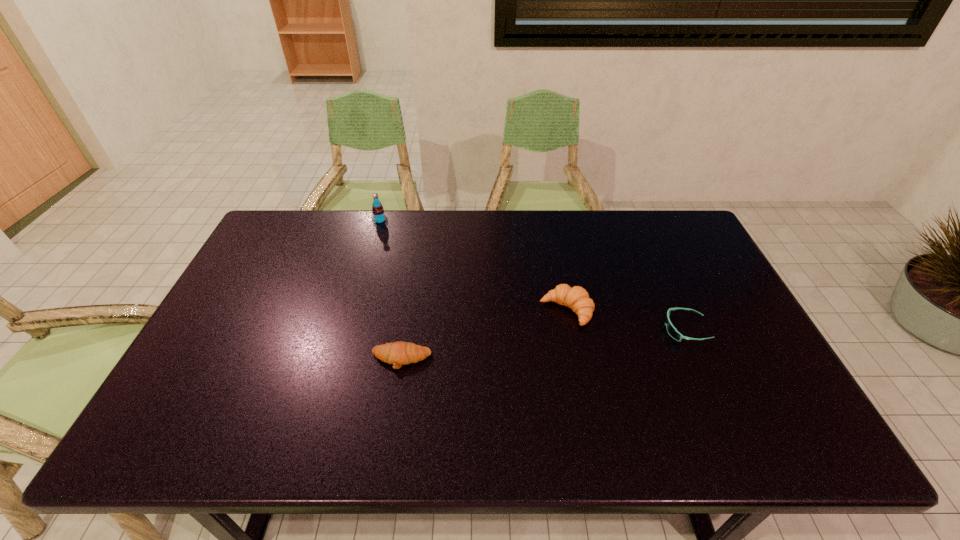
Identify the location of vacant area at the far right corner. Image resolution: width=960 pixels, height=540 pixels. (676, 235).

This screenshot has height=540, width=960. Find the location of `vacant area that lies between the taller crescent roll and the left crescent roll`. vacant area that lies between the taller crescent roll and the left crescent roll is located at coordinates (484, 335).

Find the location of a particular element. Image resolution: width=960 pixels, height=540 pixels. empty space between the nearest object and the sunglasses is located at coordinates (543, 345).

The width and height of the screenshot is (960, 540). I want to click on empty space that is in between the nearer crescent roll and the sunglasses, so click(543, 345).

In order to click on empty space between the farther crescent roll and the sunglasses in this screenshot , I will do click(x=626, y=320).

Locate an element on the screen. The height and width of the screenshot is (540, 960). vacant space in between the rightmost object and the third object from right to left is located at coordinates (543, 345).

Identify the location of free space between the shorter crescent roll and the rightmost object. (543, 345).

Locate an element on the screen. free point between the taller crescent roll and the nearer crescent roll is located at coordinates (484, 335).

Where is `free spot between the taller crescent roll and the rightmost object`? The width and height of the screenshot is (960, 540). free spot between the taller crescent roll and the rightmost object is located at coordinates (626, 320).

This screenshot has height=540, width=960. I want to click on empty location between the nearer crescent roll and the farther crescent roll, so click(x=484, y=335).